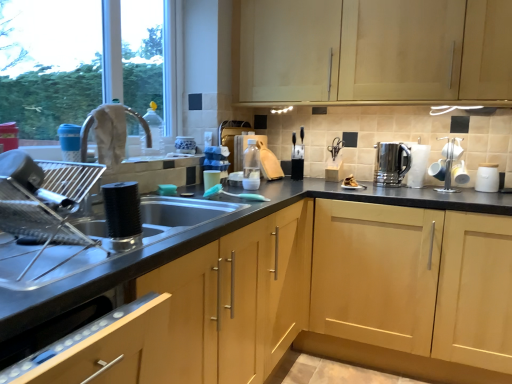
This screenshot has height=384, width=512. In order to click on vacant space in white glossy mugs at right, the 2th appliance positioned from the right (from a real-world perspective) in this screenshot , I will do `click(440, 189)`.